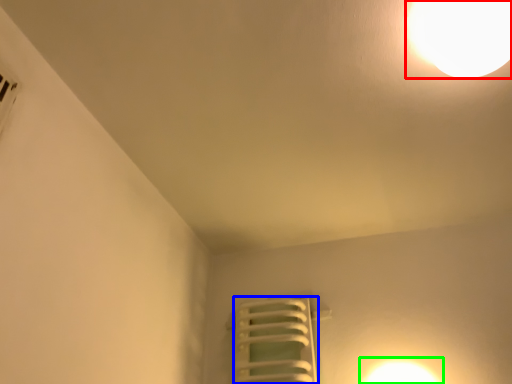
Question: Considering the real-world distances, which object is closest to lamp (highlighted by a red box)? radiator (highlighted by a blue box) or light (highlighted by a green box).

Choices:
 (A) radiator
 (B) light

Answer: (B)